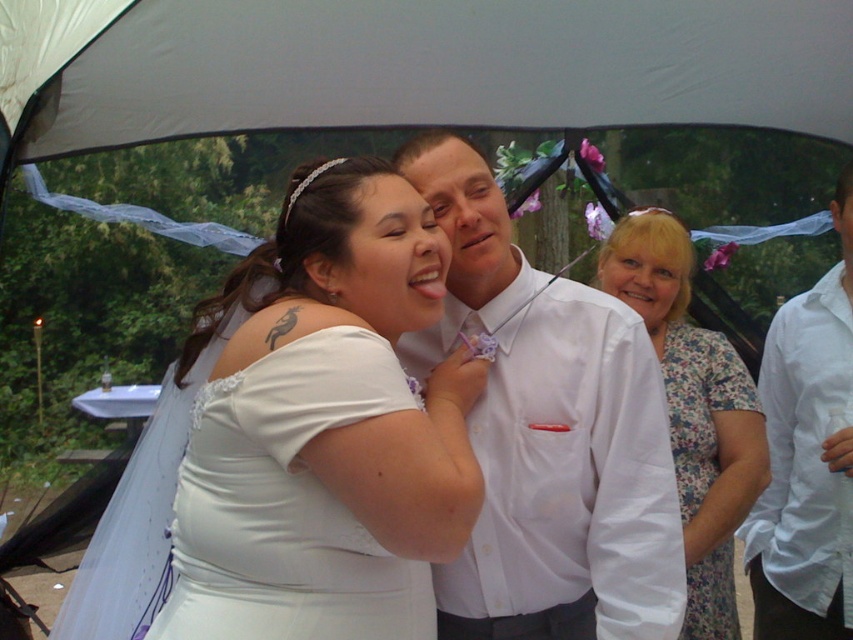
Consider the image. Measure the distance between point (817, 502) and camera.

Point (817, 502) is 2.43 meters from camera.

Is white cotton shirt at right taller than floral print dress at center?

Yes.

Does point (804, 509) come closer to viewer compared to point (708, 624)?

No, (804, 509) is behind (708, 624).

Where is `white cotton shirt at right`? This screenshot has width=853, height=640. white cotton shirt at right is located at coordinates (807, 458).

How far apart are white satin dress at center and white cotton shirt at right?

A distance of 1.17 meters exists between white satin dress at center and white cotton shirt at right.

The width and height of the screenshot is (853, 640). I want to click on white satin dress at center, so click(328, 435).

Which of these two, white fabric canopy at upper center or white satin dress at center, stands shorter?

white fabric canopy at upper center

Is white fabric canopy at upper center bigger than white satin dress at center?

Correct, white fabric canopy at upper center is larger in size than white satin dress at center.

Between point (844, 93) and point (321, 516), which one is positioned in front?

Positioned in front is point (321, 516).

The image size is (853, 640). What are the coordinates of `white fabric canopy at upper center` in the screenshot? It's located at (415, 67).